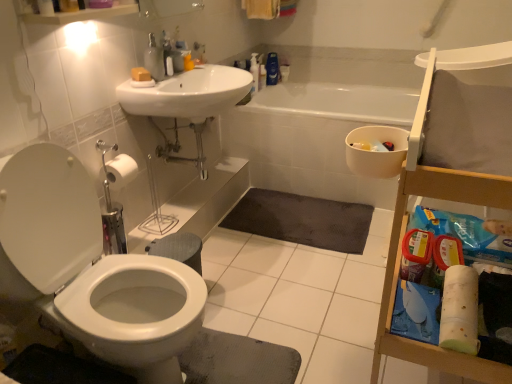
Question: Should I look upward or downward to see translucent plastic bottle at upper center, the 2th cleaning product viewed from the right?

Choices:
 (A) up
 (B) down

Answer: (A)

Question: Could you tell me if translucent plastic bottle at upper center, the 2th toiletry in the bottom-to-top sequence, is facing dark gray textured bath mat at center?

Choices:
 (A) no
 (B) yes

Answer: (A)

Question: Is translucent plastic bottle at upper center, which is counted as the 1th toiletry, starting from the right, at the right side of dark gray textured bath mat at center?

Choices:
 (A) yes
 (B) no

Answer: (B)

Question: From the image's perspective, is translucent plastic bottle at upper center, which is counted as the 1th toiletry, starting from the right, over dark gray textured bath mat at center?

Choices:
 (A) no
 (B) yes

Answer: (B)

Question: From a real-world perspective, is translucent plastic bottle at upper center, which appears as the 1th toiletry when viewed from the back, beneath dark gray textured bath mat at center?

Choices:
 (A) yes
 (B) no

Answer: (B)

Question: Would you say translucent plastic bottle at upper center, acting as the second toiletry starting from the front, is outside dark gray textured bath mat at center?

Choices:
 (A) yes
 (B) no

Answer: (A)

Question: Is there a large distance between translucent plastic bottle at upper center, marked as the 2th toiletry in a left-to-right arrangement, and dark gray textured bath mat at center?

Choices:
 (A) yes
 (B) no

Answer: (A)

Question: From a real-world perspective, does metallic silver pipes at center sit lower than blue glossy bottle at upper center, positioned as the first cleaning product in right-to-left order?

Choices:
 (A) no
 (B) yes

Answer: (B)

Question: Would you say metallic silver pipes at center is outside blue glossy bottle at upper center, which is the second cleaning product from left to right?

Choices:
 (A) yes
 (B) no

Answer: (A)

Question: From the image's perspective, is metallic silver pipes at center above blue glossy bottle at upper center, positioned as the first cleaning product in right-to-left order?

Choices:
 (A) no
 (B) yes

Answer: (A)

Question: Considering the relative sizes of metallic silver pipes at center and blue glossy bottle at upper center, which is the second cleaning product from left to right, in the image provided, is metallic silver pipes at center wider than blue glossy bottle at upper center, which is the second cleaning product from left to right,?

Choices:
 (A) yes
 (B) no

Answer: (A)

Question: Could you tell me if metallic silver pipes at center is turned towards blue glossy bottle at upper center, which is the second cleaning product from left to right?

Choices:
 (A) no
 (B) yes

Answer: (A)

Question: Does metallic silver pipes at center have a lesser height compared to blue glossy bottle at upper center, positioned as the first cleaning product in right-to-left order?

Choices:
 (A) no
 (B) yes

Answer: (A)

Question: Considering the relative sizes of metallic silver pipes at center and dark gray textured bath mat at center in the image provided, is metallic silver pipes at center wider than dark gray textured bath mat at center?

Choices:
 (A) yes
 (B) no

Answer: (B)